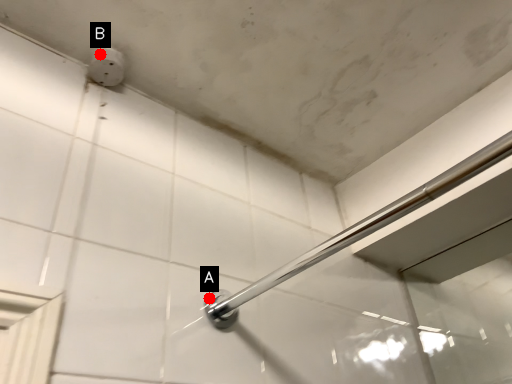
Question: Two points are circled on the image, labeled by A and B beside each circle. Which point is closer to the camera?

Choices:
 (A) A is closer
 (B) B is closer

Answer: (A)